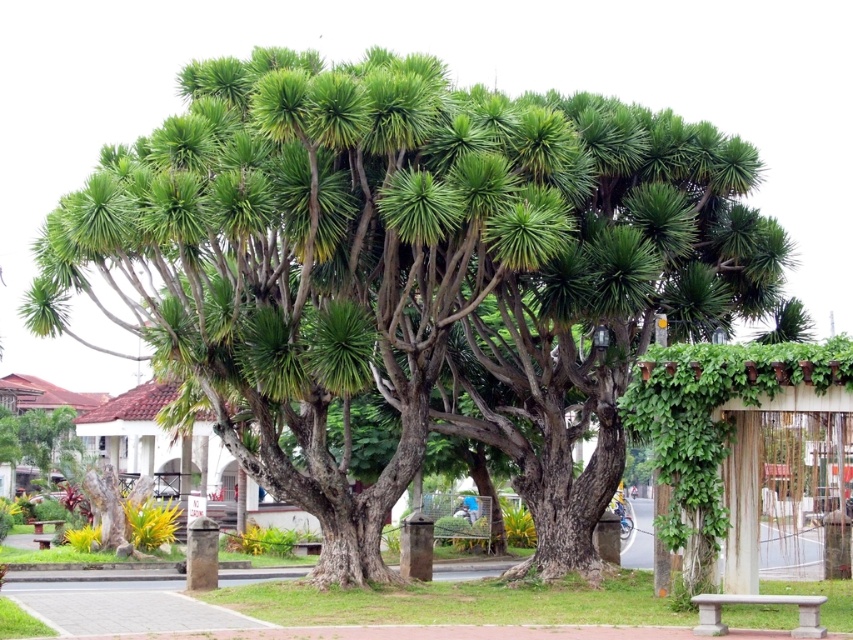
You are a visitor in the park and want to sit on either the gray concrete bench at lower right or the wooden bench at lower left. Which bench is higher up the pathway?

The gray concrete bench at lower right is located above the wooden bench at lower left, so it is higher up the pathway.

You are standing at the point with coordinates point (703, 632) and want to walk towards the point (61, 518). Given that the path is clear, which direction should you face to move directly towards your destination?

Since point (703, 632) is closer to the viewer than point 0.072, you should face downwards to move directly towards point (61, 518).